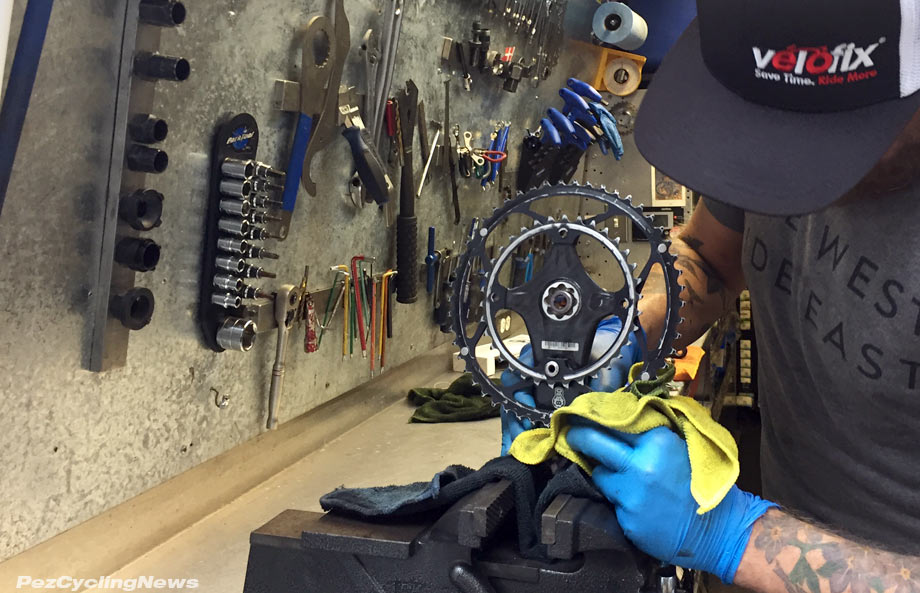
The width and height of the screenshot is (920, 593). Identify the location of empty table thats light brown. 196,557, 301,487, 366,428, 420,444.